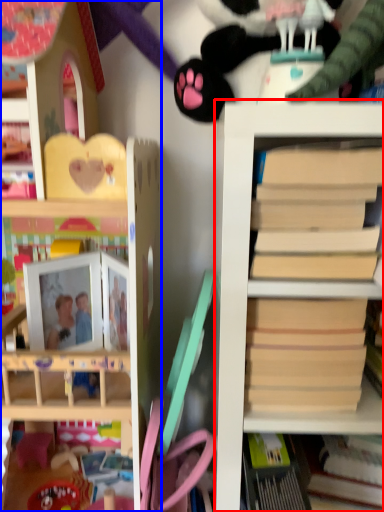
Question: Which of the following is the closest to the observer, shelf (highlighted by a red box) or shelf (highlighted by a blue box)?

Choices:
 (A) shelf
 (B) shelf

Answer: (A)